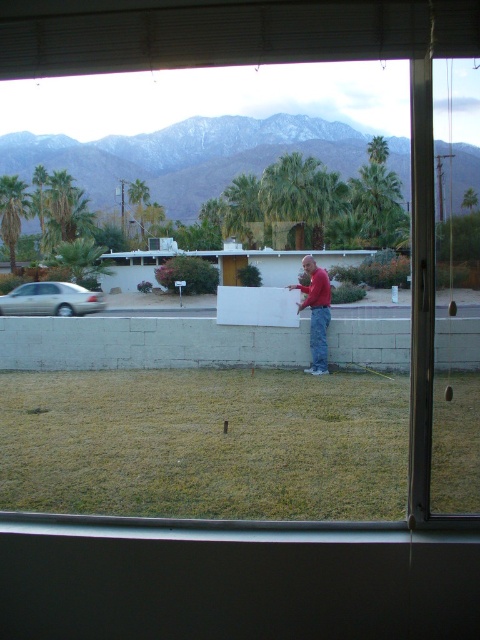
Is green grass at lower center further to camera compared to gold metallic sedan at left?

No, green grass at lower center is in front of gold metallic sedan at left.

Who is lower down, green grass at lower center or gold metallic sedan at left?

Positioned lower is green grass at lower center.

Identify the location of green grass at lower center. The height and width of the screenshot is (640, 480). (205, 444).

Is green grass at lower center further to the viewer compared to red cotton shirt at center?

No.

Does point (116, 412) come behind point (298, 310)?

No, (116, 412) is closer to viewer.

Who is more forward, (384, 486) or (321, 288)?

Point (384, 486)

Where is `green grass at lower center`? green grass at lower center is located at coordinates (205, 444).

What do you see at coordinates (377, 202) in the screenshot? I see `green leafy palm tree at upper center` at bounding box center [377, 202].

Can you confirm if green leafy palm tree at upper center is taller than green leafy palm tree at left?

No.

Is point (360, 205) positioned after point (7, 228)?

No, it is in front of (7, 228).

Identify the location of green leafy palm tree at upper center. (377, 202).